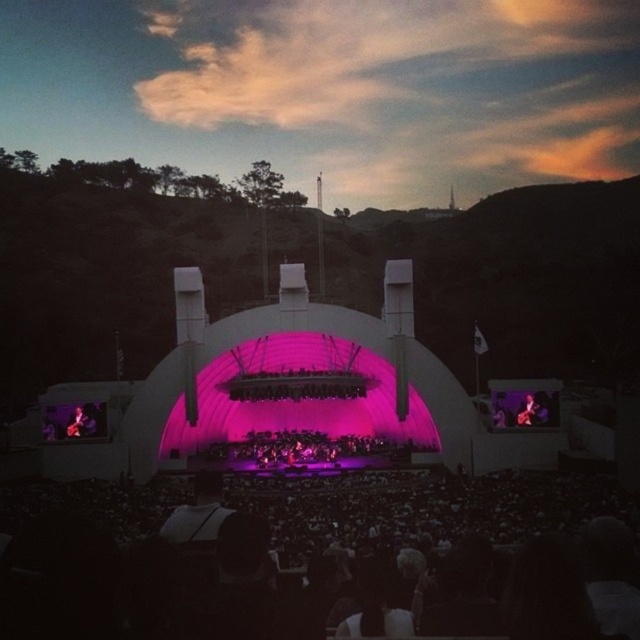
Is point (515, 484) positioned after point (522, 424)?

That is False.

Is black fabric crowd at lower center wider than matte black guitar at center?

Indeed, black fabric crowd at lower center has a greater width compared to matte black guitar at center.

Is point (525, 477) positioned before point (532, 417)?

That is True.

Identify the location of black fabric crowd at lower center. This screenshot has height=640, width=640. (422, 506).

Is point (314, 452) positioned in front of point (536, 410)?

No, it is behind (536, 410).

Can you confirm if shiny purple dress at center is positioned to the left of matte black guitar at center?

Correct, you'll find shiny purple dress at center to the left of matte black guitar at center.

Is point (387, 449) in front of point (536, 412)?

No, (387, 449) is further to viewer.

Where is `shiny purple dress at center`? Image resolution: width=640 pixels, height=640 pixels. shiny purple dress at center is located at coordinates (317, 448).

Can you confirm if matte black guitar at center is positioned above metallic guitar at center?

Yes.

Does matte black guitar at center appear under metallic guitar at center?

No.

From the picture: Measure the distance between point (544,396) and camera.

123.09 meters

You are a GUI agent. You are given a task and a screenshot of the screen. Output one action in this format:
    pyautogui.click(x=<x>, y=<y>)
    Task: Click on the matte black guitar at center
    
    Given the screenshot: What is the action you would take?
    pyautogui.click(x=532, y=410)